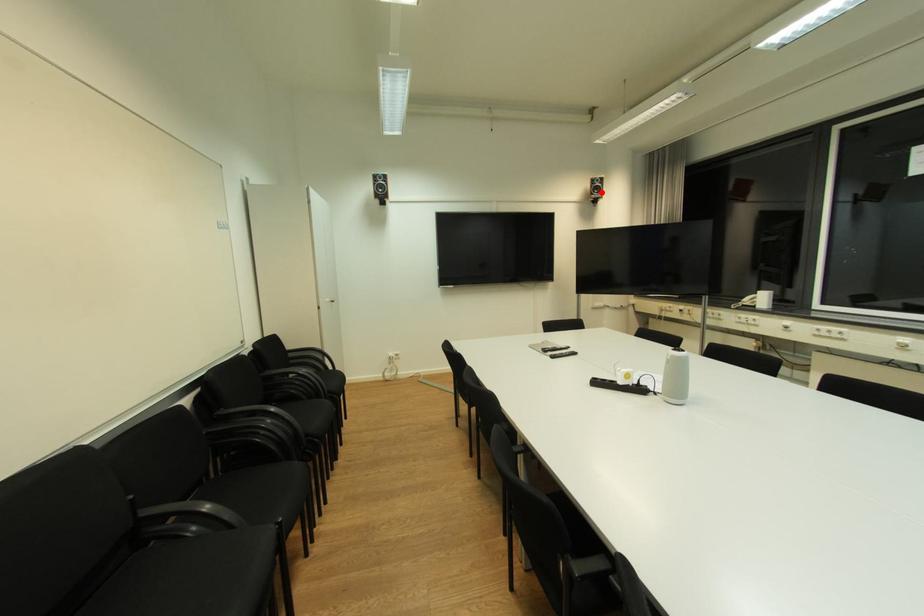
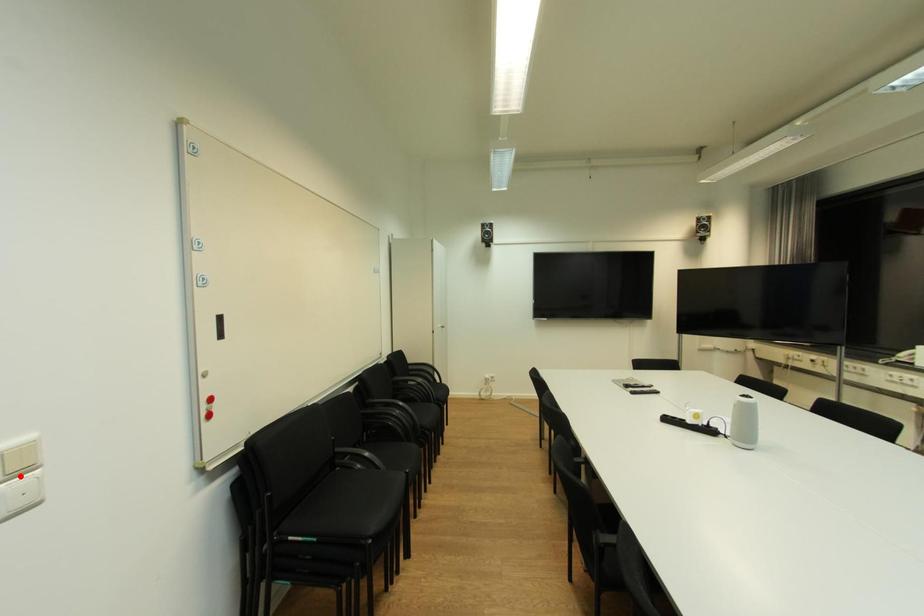
I am providing you with two images of the same scene from different viewpoints. A red point is marked on the first image and another point is marked on the second image. Is the red point in image1 aligned with the point shown in image2?

No